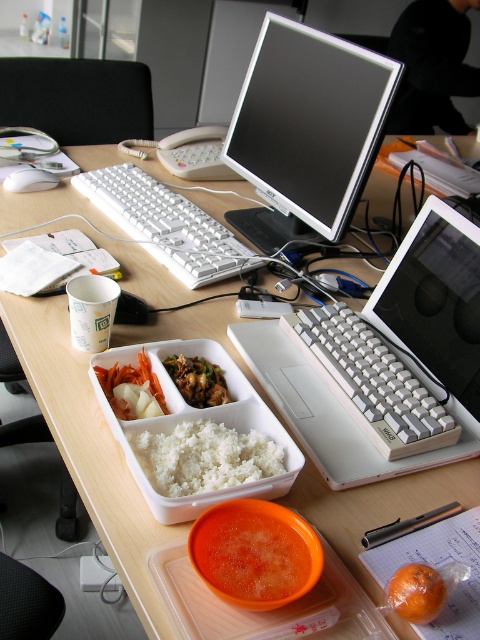
You are organizing the desk and need to place a new document holder between the white plastic laptop at center and the white plastic keyboard at center. Based on their current positions, where should you place the document holder?

The white plastic laptop at center is positioned on the right side of the white plastic keyboard at center, so you should place the document holder between them, to the right of the keyboard and left of the laptop.

What is the position of the point labeled as point (x=204, y=458) in the workspace setup?

The point labeled as point (x=204, y=458) is located on the white matte rice at center.